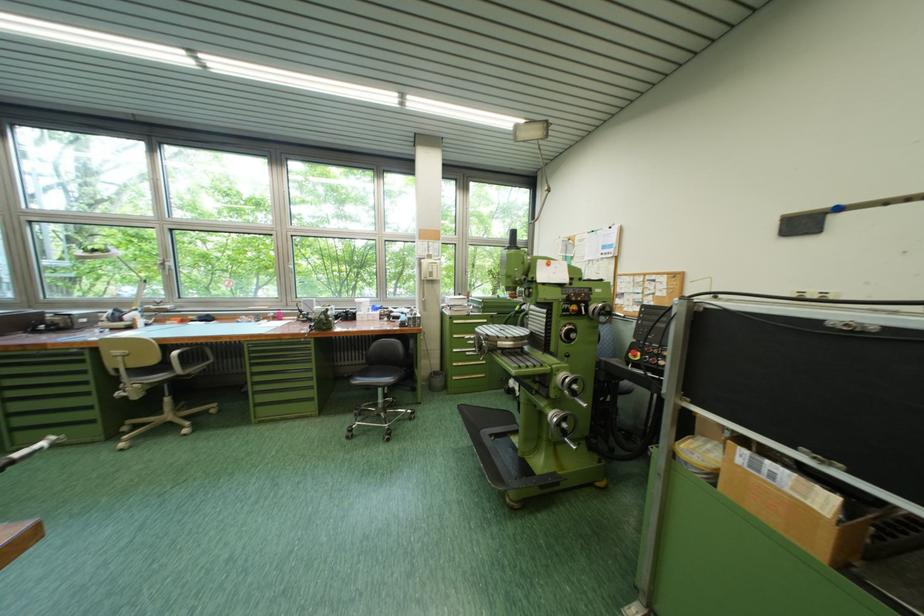
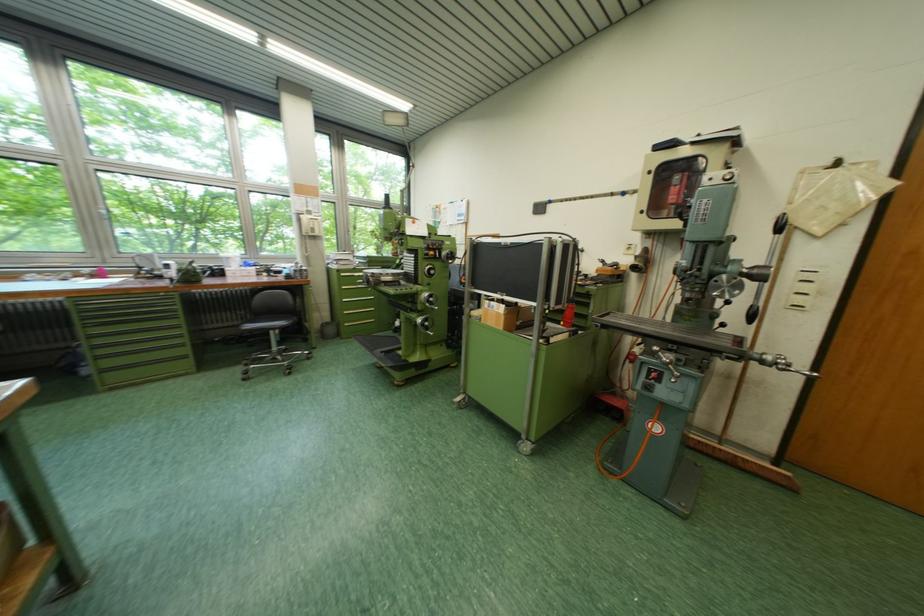
Question: I am providing you with two images of the same scene from different viewpoints. After the viewpoint changes to image2, which objects are now occluded?

Choices:
 (A) black chair sitting surface
 (B) green drawer handle
 (C) white telephone handset
 (D) none of these

Answer: (D)